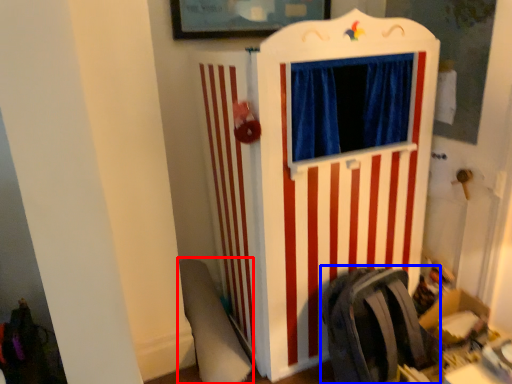
Question: Which object appears closest to the camera in this image, swivel chair (highlighted by a red box) or folding chair (highlighted by a blue box)?

Choices:
 (A) swivel chair
 (B) folding chair

Answer: (B)